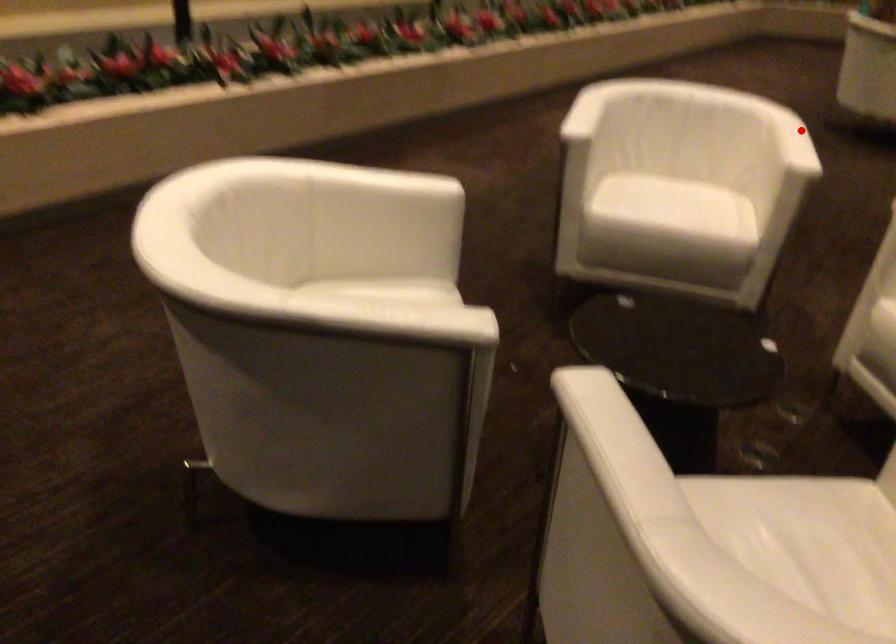
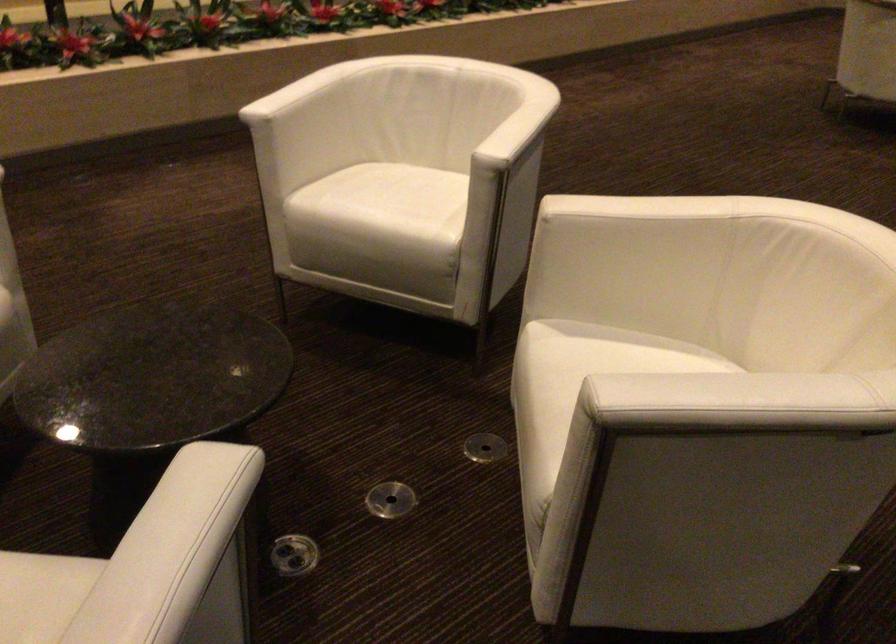
Locate, in the second image, the point that corresponds to the highlighted location in the first image.

(515, 122)